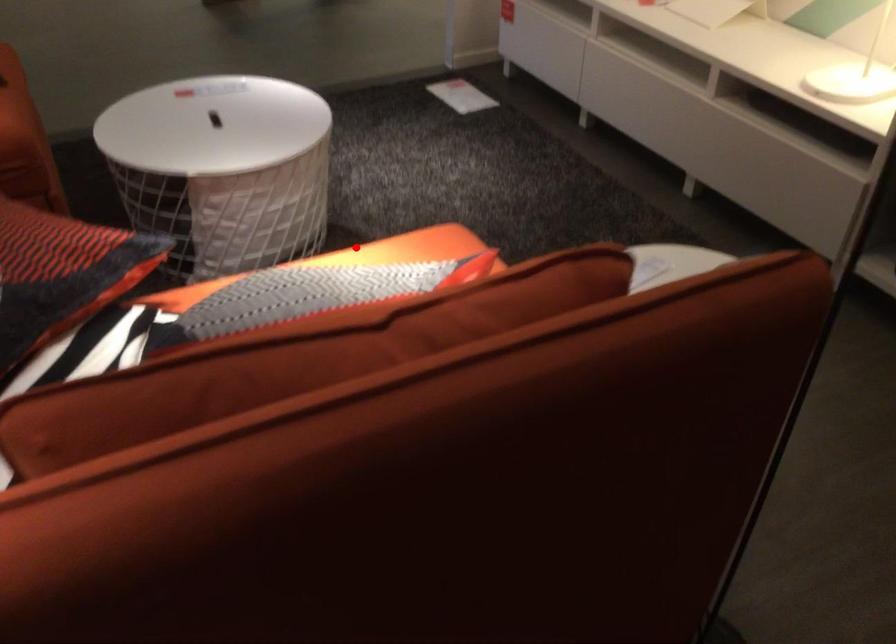
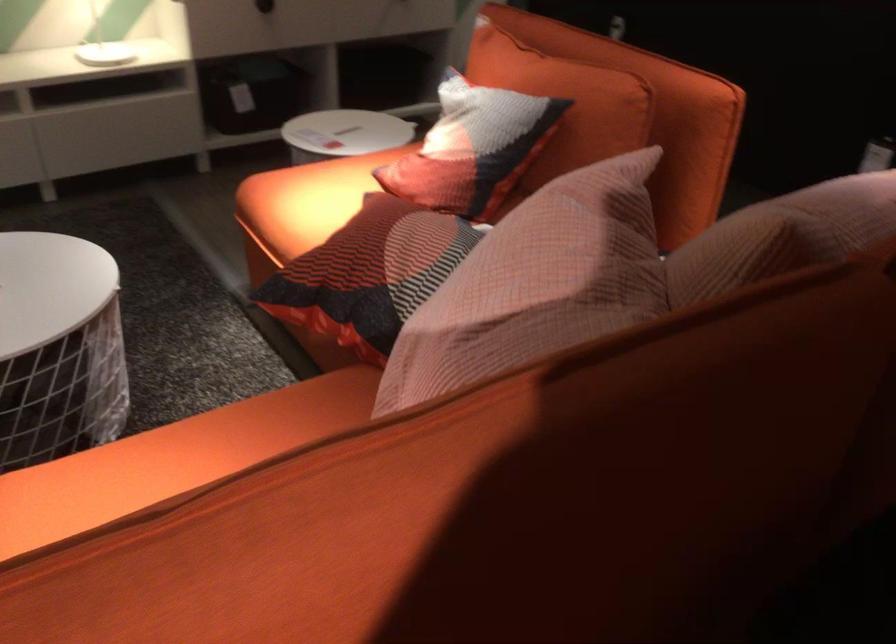
Locate, in the second image, the point that corresponds to the highlighted location in the first image.

(306, 200)